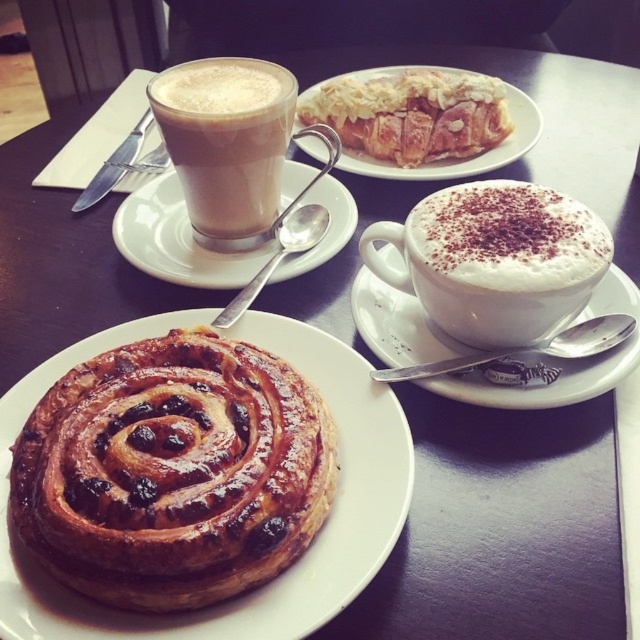
You are a customer at the cafe and want to grab both the golden flaky pastry at upper center and the white ceramic saucer at upper right. Which one should you reach for first to avoid knocking over the other?

You should reach for the golden flaky pastry at upper center first because it is closer to you than the white ceramic saucer at upper right, which is further away.

You are a barista arranging items on a narrow shelf. You have a matte glass cup at upper left and a white ceramic saucer at upper right. Which item should you place first if you want to fit both on the shelf without overlapping?

The matte glass cup at upper left has a lesser width compared to the white ceramic saucer at upper right. Therefore, you should place the wider item, the white ceramic saucer at upper right, first to ensure both fit on the shelf.